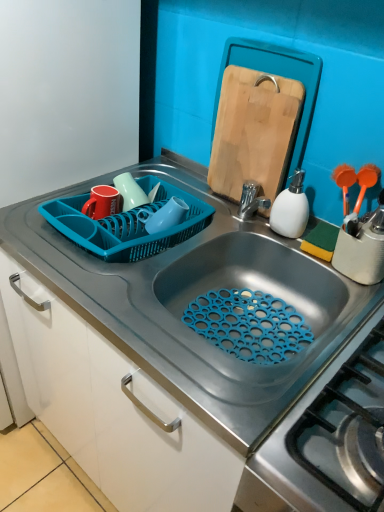
Question: Considering the relative positions of smooth gray countertop at center and wooden cutting board at upper right in the image provided, is smooth gray countertop at center behind wooden cutting board at upper right?

Choices:
 (A) yes
 (B) no

Answer: (B)

Question: Considering the relative sizes of smooth gray countertop at center and wooden cutting board at upper right in the image provided, is smooth gray countertop at center thinner than wooden cutting board at upper right?

Choices:
 (A) no
 (B) yes

Answer: (A)

Question: From the image's perspective, is smooth gray countertop at center under wooden cutting board at upper right?

Choices:
 (A) yes
 (B) no

Answer: (A)

Question: Can you confirm if smooth gray countertop at center is smaller than wooden cutting board at upper right?

Choices:
 (A) no
 (B) yes

Answer: (A)

Question: Is smooth gray countertop at center in contact with wooden cutting board at upper right?

Choices:
 (A) no
 (B) yes

Answer: (A)

Question: Is matte ceramic mugs at upper center, placed as the second tableware when sorted from left to right, in front of or behind smooth gray countertop at center in the image?

Choices:
 (A) behind
 (B) front

Answer: (A)

Question: From their relative heights in the image, would you say matte ceramic mugs at upper center, which appears as the first tableware when viewed from the right, is taller or shorter than smooth gray countertop at center?

Choices:
 (A) tall
 (B) short

Answer: (B)

Question: From the image's perspective, is matte ceramic mugs at upper center, placed as the second tableware when sorted from left to right, located above or below smooth gray countertop at center?

Choices:
 (A) below
 (B) above

Answer: (B)

Question: In the image, is matte ceramic mugs at upper center, which appears as the first tableware when viewed from the right, on the left side or the right side of smooth gray countertop at center?

Choices:
 (A) left
 (B) right

Answer: (A)

Question: From the image's perspective, is matte ceramic mugs at upper center, placed as the second tableware when sorted from left to right, positioned above or below wooden cutting board at upper right?

Choices:
 (A) below
 (B) above

Answer: (A)

Question: Visually, is matte ceramic mugs at upper center, which appears as the first tableware when viewed from the right, positioned to the left or to the right of wooden cutting board at upper right?

Choices:
 (A) right
 (B) left

Answer: (B)

Question: Is matte ceramic mugs at upper center, which appears as the first tableware when viewed from the right, inside the boundaries of wooden cutting board at upper right, or outside?

Choices:
 (A) outside
 (B) inside

Answer: (A)

Question: From a real-world perspective, is matte ceramic mugs at upper center, placed as the second tableware when sorted from left to right, above or below wooden cutting board at upper right?

Choices:
 (A) below
 (B) above

Answer: (A)

Question: Looking at their shapes, would you say white matte soap dispenser at right is wider or thinner than matte ceramic mugs at upper center, which appears as the first tableware when viewed from the right?

Choices:
 (A) wide
 (B) thin

Answer: (B)

Question: Relative to matte ceramic mugs at upper center, placed as the second tableware when sorted from left to right, is white matte soap dispenser at right in front or behind?

Choices:
 (A) behind
 (B) front

Answer: (B)